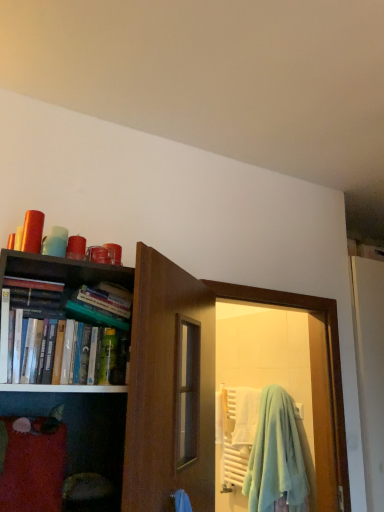
Question: Is green plastic bottle at center next to hardcover books at left?

Choices:
 (A) yes
 (B) no

Answer: (B)

Question: Can you confirm if green plastic bottle at center is bigger than hardcover books at left?

Choices:
 (A) no
 (B) yes

Answer: (A)

Question: Can you confirm if green plastic bottle at center is wider than hardcover books at left?

Choices:
 (A) no
 (B) yes

Answer: (A)

Question: Is hardcover books at left completely or partially inside green plastic bottle at center?

Choices:
 (A) no
 (B) yes

Answer: (A)

Question: From a real-world perspective, is green plastic bottle at center located higher than hardcover books at left?

Choices:
 (A) yes
 (B) no

Answer: (B)

Question: From a real-world perspective, does green plastic bottle at center sit lower than hardcover books at left?

Choices:
 (A) yes
 (B) no

Answer: (A)

Question: Are hardcover books at left and light blue fleece beach towel at door making contact?

Choices:
 (A) yes
 (B) no

Answer: (B)

Question: Is hardcover books at left to the left of light blue fleece beach towel at door from the viewer's perspective?

Choices:
 (A) no
 (B) yes

Answer: (B)

Question: Is hardcover books at left oriented away from light blue fleece beach towel at door?

Choices:
 (A) yes
 (B) no

Answer: (B)

Question: Would you say hardcover books at left is a long distance from light blue fleece beach towel at door?

Choices:
 (A) yes
 (B) no

Answer: (A)

Question: Is hardcover books at left further to the viewer compared to light blue fleece beach towel at door?

Choices:
 (A) yes
 (B) no

Answer: (B)

Question: Considering the relative positions of hardcover books at left and light blue fleece beach towel at door in the image provided, is hardcover books at left to the right of light blue fleece beach towel at door from the viewer's perspective?

Choices:
 (A) no
 (B) yes

Answer: (A)

Question: From a real-world perspective, is light blue fleece beach towel at door physically above hardcover books at left?

Choices:
 (A) yes
 (B) no

Answer: (B)